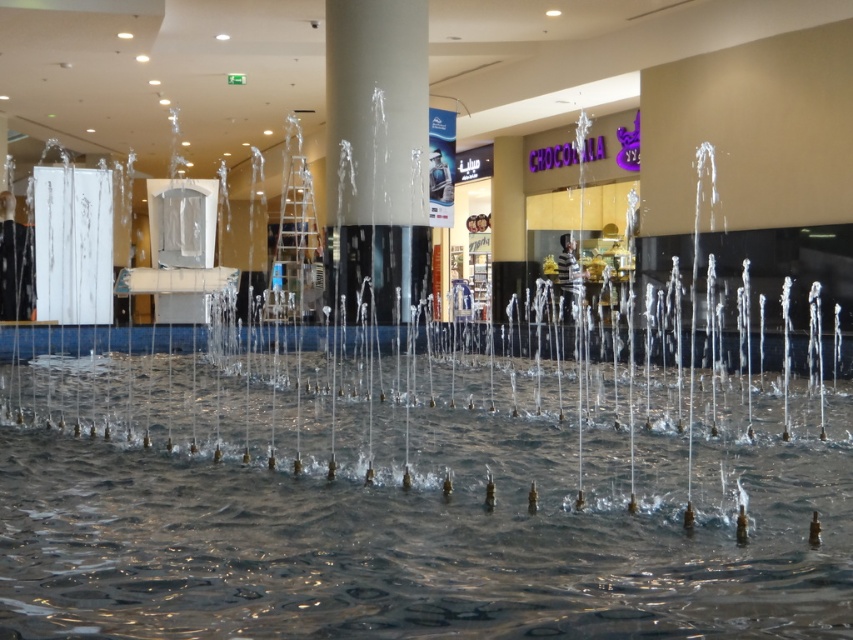
Image resolution: width=853 pixels, height=640 pixels. Describe the element at coordinates (410, 509) in the screenshot. I see `clear water at center` at that location.

Which is behind, point (215, 509) or point (381, 284)?

The point (381, 284) is behind.

Identify the location of clear water at center. This screenshot has height=640, width=853. (410, 509).